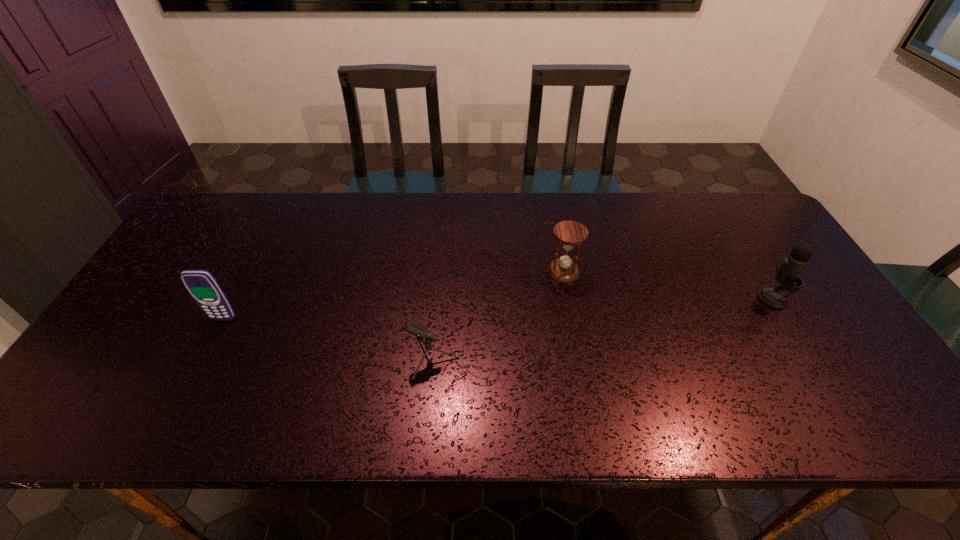
What are the coordinates of `free space between the farthest object and the second object from left to right` in the screenshot? It's located at (510, 316).

Locate an element on the screen. vacant point located between the third nearest object and the farthest object is located at coordinates (668, 285).

At what (x,y) coordinates should I click in order to perform the action: click on free space that is in between the third farthest object and the nearer microphone. Please return your answer as a coordinate pair (x, y). Looking at the image, I should click on (339, 339).

Image resolution: width=960 pixels, height=540 pixels. Find the location of `free spot between the nearest object and the farthest object`. free spot between the nearest object and the farthest object is located at coordinates (510, 316).

The image size is (960, 540). In order to click on blank region between the second nearest object and the taller microphone in this screenshot , I will do coord(498,308).

Where is `vacant area between the third farthest object and the farther microphone`? This screenshot has height=540, width=960. vacant area between the third farthest object and the farther microphone is located at coordinates (498, 308).

Locate an element on the screen. The width and height of the screenshot is (960, 540). free space between the taller microphone and the hourglass is located at coordinates (668, 285).

This screenshot has width=960, height=540. Identify the location of unoccupied position between the cellular telephone and the shorter microphone. (339, 339).

I want to click on empty location between the leftmost object and the left microphone, so click(339, 339).

Image resolution: width=960 pixels, height=540 pixels. In order to click on vacant area between the second nearest object and the right microphone in this screenshot , I will do `click(498, 308)`.